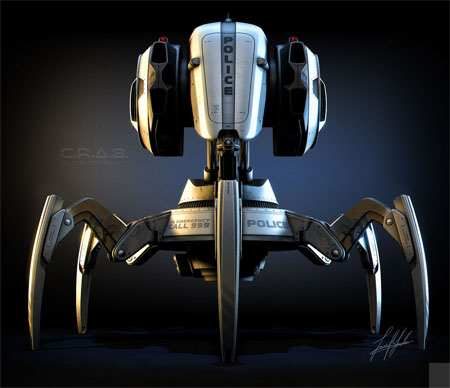
This screenshot has height=388, width=450. Identify the location of emergency instructions. (185, 223).